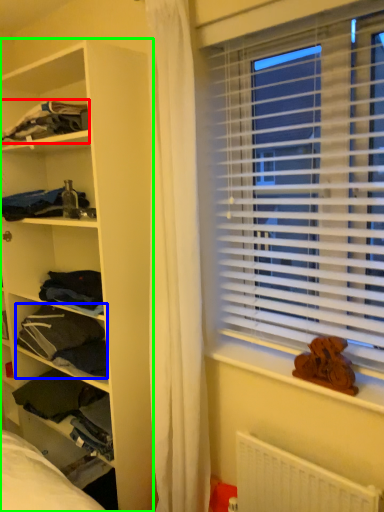
Question: Considering the real-world distances, which object is farthest from clothing (highlighted by a red box)? clothing (highlighted by a blue box) or shelf (highlighted by a green box)?

Choices:
 (A) clothing
 (B) shelf

Answer: (A)